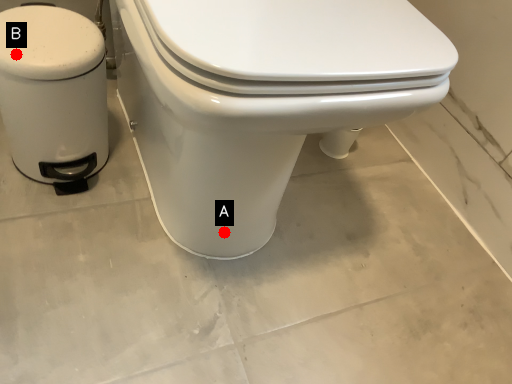
Question: Two points are circled on the image, labeled by A and B beside each circle. Among these points, which one is nearest to the camera?

Choices:
 (A) A is closer
 (B) B is closer

Answer: (B)